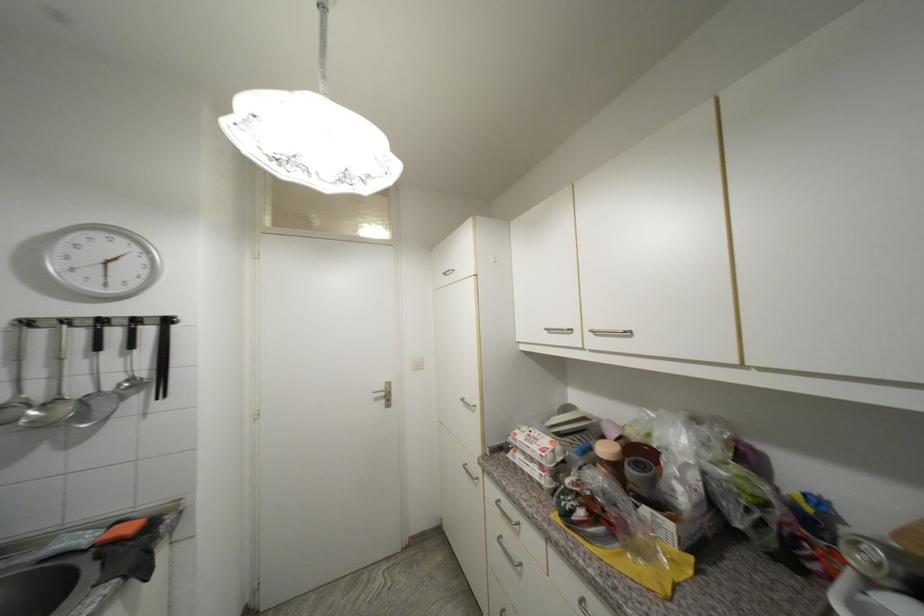
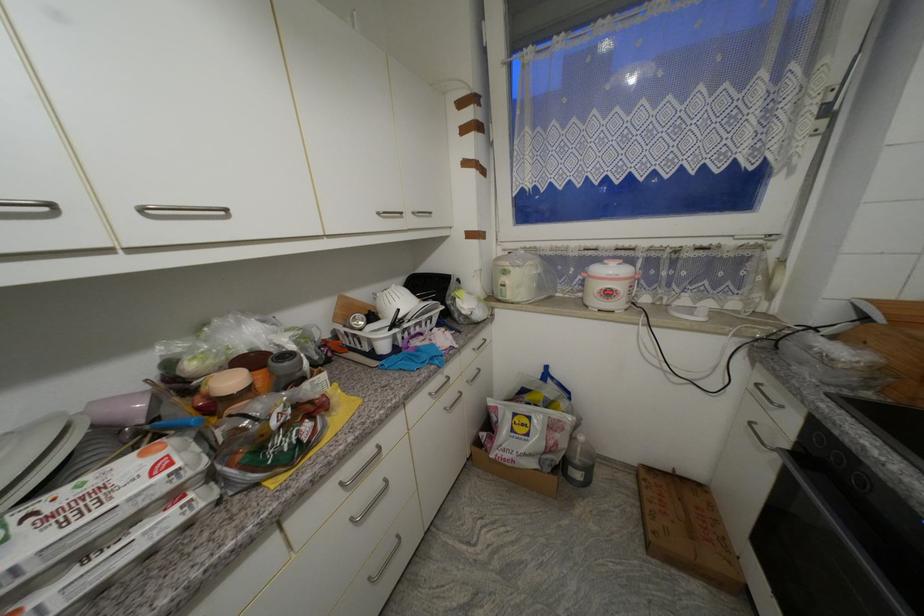
Where in the second image is the point corresponding to (x=556, y=444) from the first image?

(149, 456)